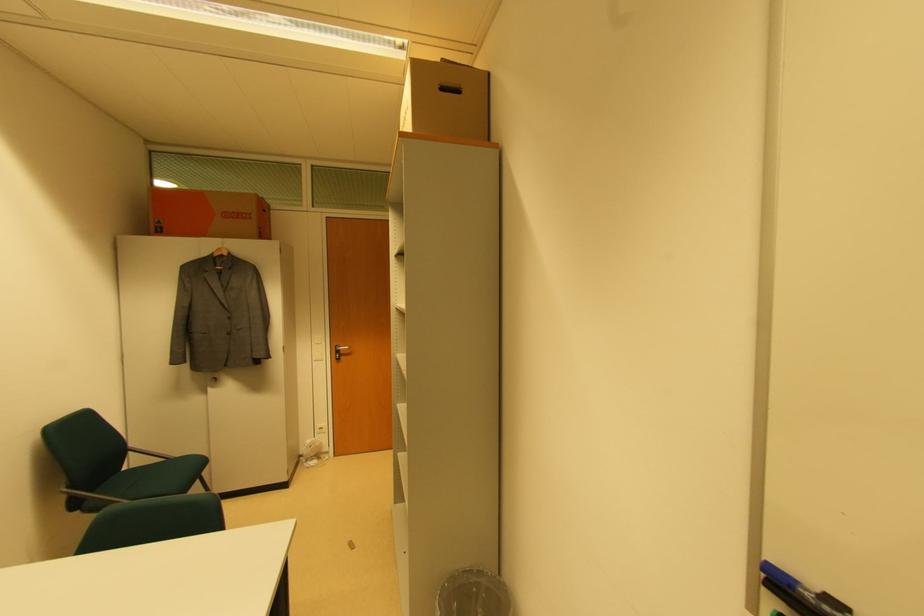
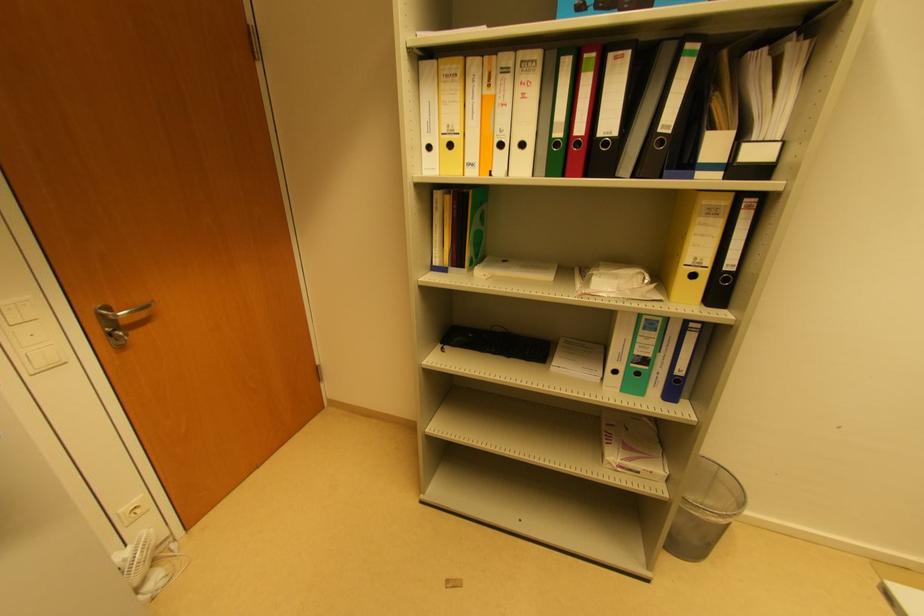
Find the pixel in the second image that matches (x=314, y=464) in the first image.

(157, 580)